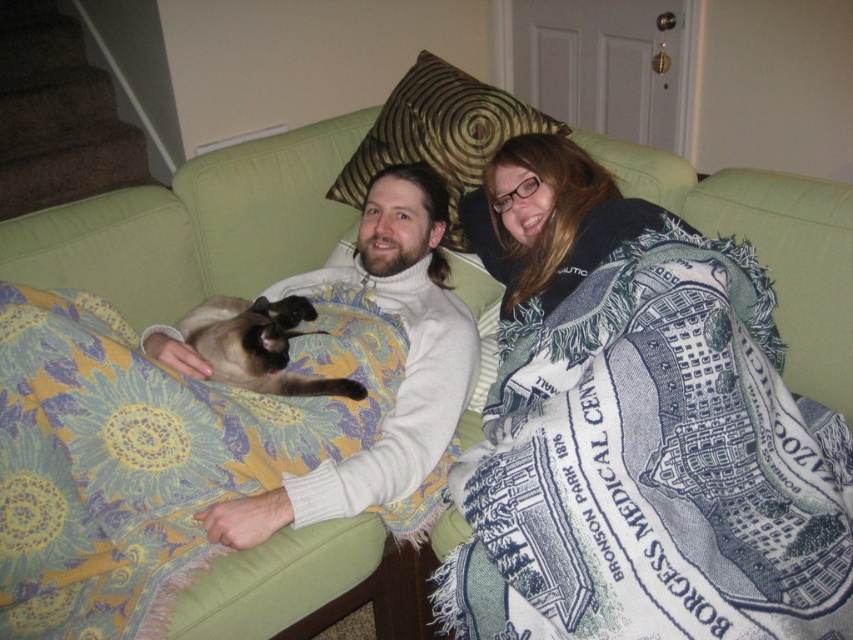
You are a pet sitter who needs to separate the two cats. The silky fur cat at left and the silky brown fur cat at center are currently in the same area. Based on their positions, which cat is located underneath the other?

The silky fur cat at left is positioned under the silky brown fur cat at center, so the silky fur cat at left is underneath the silky brown fur cat at center.

You are a photographer setting up a shoot in this living room. You need to position a tall tripod between the blue printed blanket at upper right and the yellow floral fabric at left. Which side of the space between them should you place the tripod to ensure it doesn

The blue printed blanket at upper right is much taller than the yellow floral fabric at left, so placing the tripod closer to the blue printed blanket at upper right side would provide enough vertical space for the tall tripod.